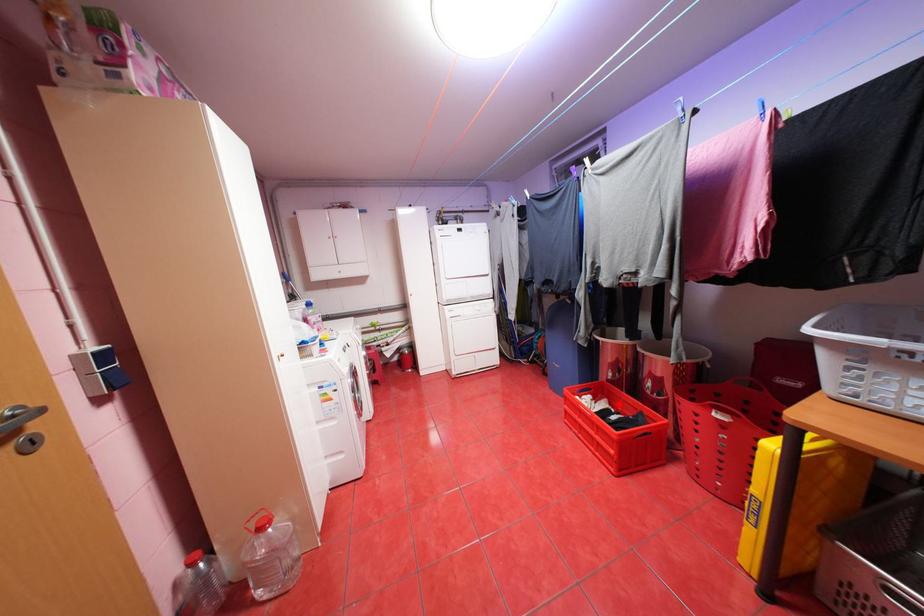
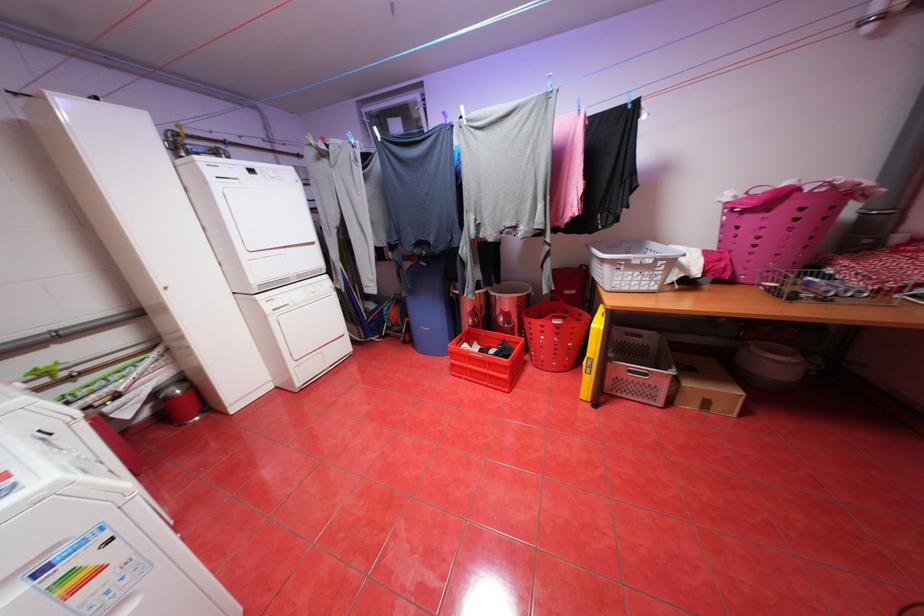
Where in the second image is the point corresponding to the highlighted location from the first image?

(488, 344)